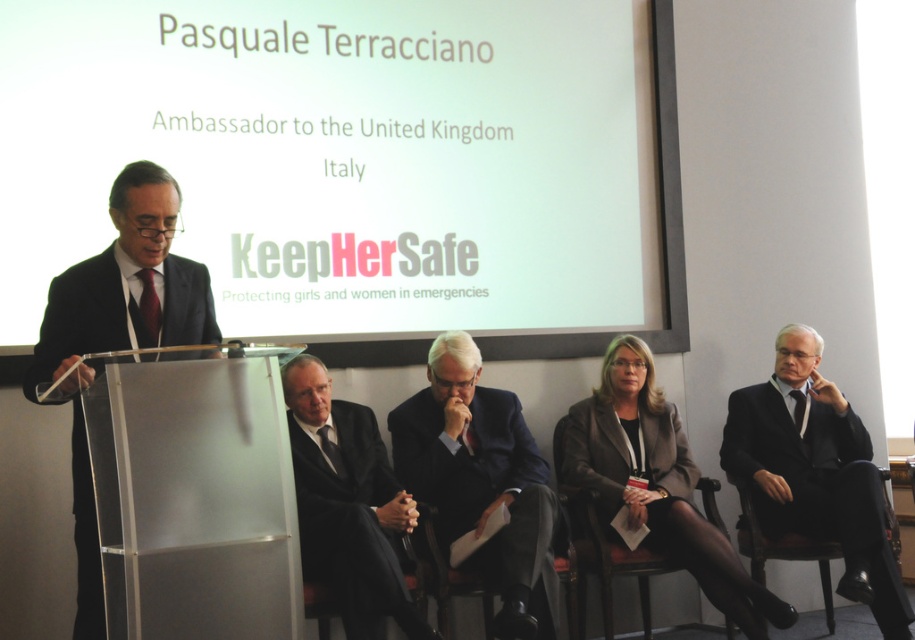
Question: Does black suit at right have a lesser width compared to matte gray blazer at center?

Choices:
 (A) yes
 (B) no

Answer: (A)

Question: Can you confirm if black suit at right is smaller than black glossy suit at left?

Choices:
 (A) no
 (B) yes

Answer: (A)

Question: Among these objects, which one is farthest from the camera?

Choices:
 (A) black matte suit at center
 (B) matte gray blazer at center
 (C) black suit at right
 (D) dark blue fabric business suit at center

Answer: (C)

Question: Can you confirm if matte gray blazer at center is wider than black glossy suit at left?

Choices:
 (A) no
 (B) yes

Answer: (B)

Question: Which point is closer to the camera?

Choices:
 (A) matte gray blazer at center
 (B) black glossy suit at left
 (C) dark blue fabric business suit at center

Answer: (B)

Question: Which object is the farthest from the black glossy suit at left?

Choices:
 (A) black suit at right
 (B) matte gray blazer at center
 (C) black matte suit at center
 (D) dark blue fabric business suit at center

Answer: (A)